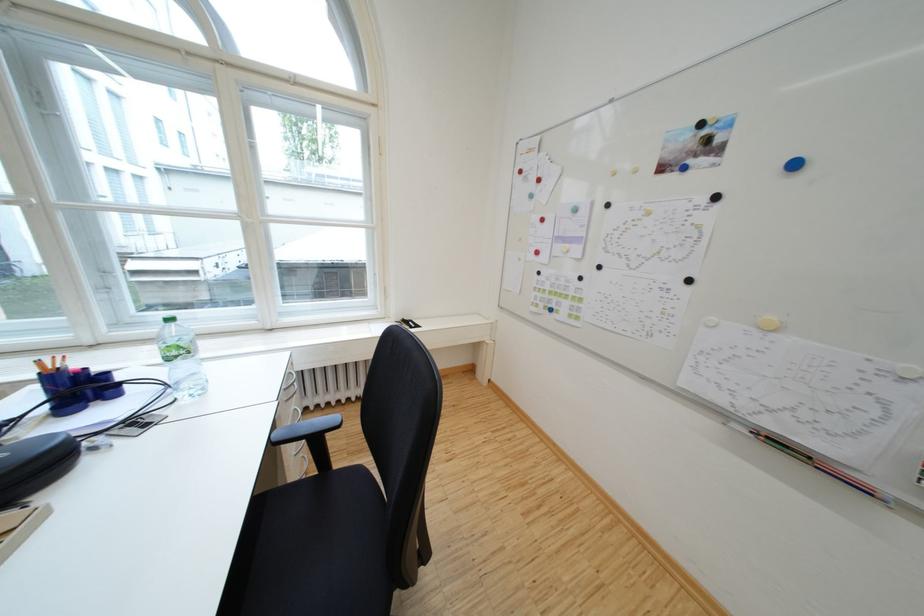
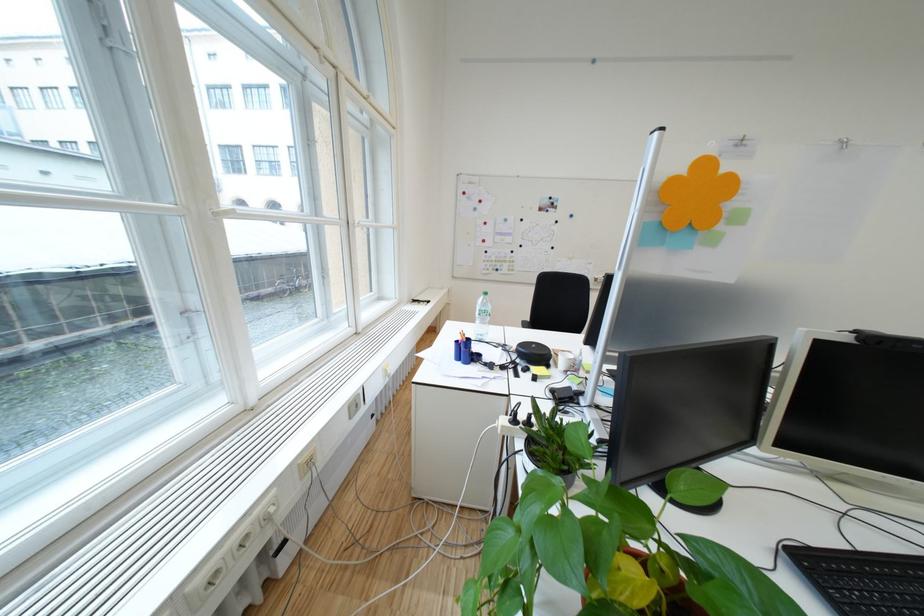
Question: I am providing you with two images of the same scene from different viewpoints. After the viewpoint changes to image2, which objects are now occluded?

Choices:
 (A) brown pinecone
 (B) blue pen holder
 (C) power strip switch
 (D) plastic water bottle

Answer: (B)